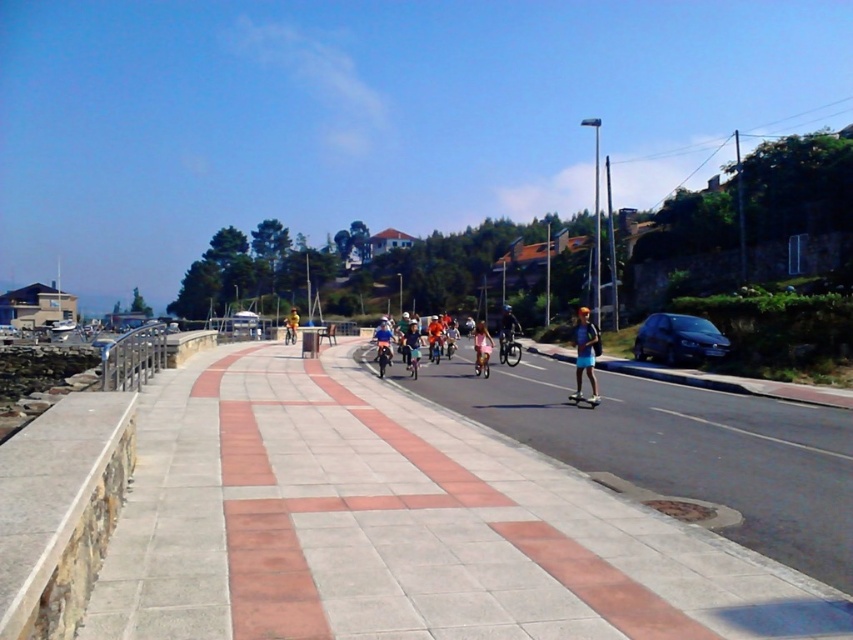
Does brick paved sidewalk at center appear over yellow fabric cyclist at center?

Incorrect, brick paved sidewalk at center is not positioned above yellow fabric cyclist at center.

Looking at this image, is brick paved sidewalk at center to the right of yellow fabric cyclist at center from the viewer's perspective?

Correct, you'll find brick paved sidewalk at center to the right of yellow fabric cyclist at center.

In the scene shown: Who is more forward, (421, 481) or (293, 321)?

Point (421, 481) is more forward.

Image resolution: width=853 pixels, height=640 pixels. I want to click on brick paved sidewalk at center, so (401, 525).

Does brick paved sidewalk at center come in front of matte pink shorts at center?

Yes.

Is brick paved sidewalk at center taller than matte pink shorts at center?

No.

Image resolution: width=853 pixels, height=640 pixels. Find the location of `brick paved sidewalk at center`. brick paved sidewalk at center is located at coordinates (401, 525).

I want to click on brick paved sidewalk at center, so click(x=401, y=525).

Which is more to the right, dark blue metallic car at right or light blue shorts at center?

From the viewer's perspective, dark blue metallic car at right appears more on the right side.

Between point (639, 352) and point (592, 380), which one is positioned in front?

Point (592, 380) is more forward.

Measure the distance between dark blue metallic car at right and camera.

A distance of 70.92 feet exists between dark blue metallic car at right and camera.

What are the coordinates of `dark blue metallic car at right` in the screenshot? It's located at (677, 339).